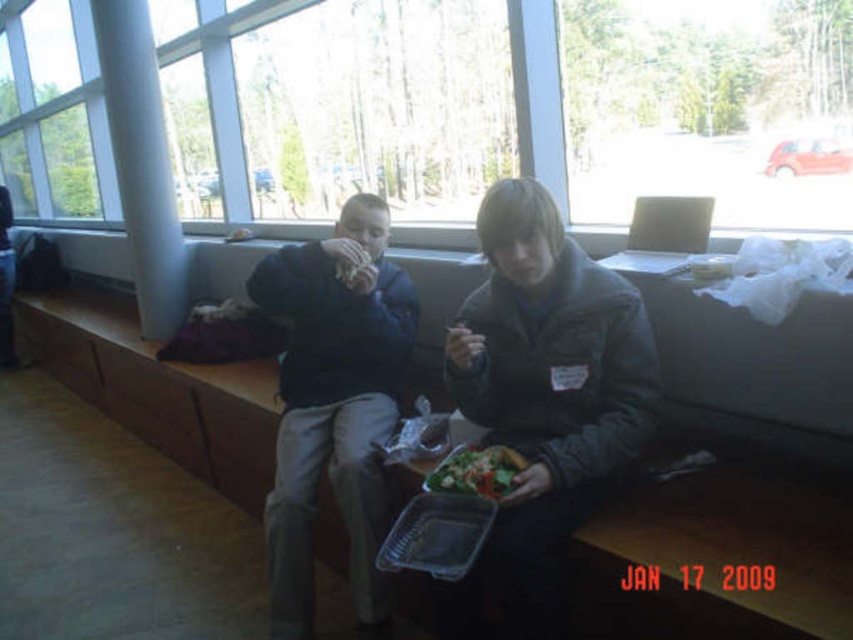
Between transparent glass window at upper center and matte brown sandwich at center, which one has less height?

Standing shorter between the two is matte brown sandwich at center.

Which is behind, point (222, 218) or point (363, 253)?

Positioned behind is point (222, 218).

Between point (790, 24) and point (360, 262), which one is positioned in front?

Point (790, 24) is more forward.

You are a GUI agent. You are given a task and a screenshot of the screen. Output one action in this format:
    pyautogui.click(x=<x>, y=<y>)
    Task: Click on the transparent glass window at upper center
    
    Given the screenshot: What is the action you would take?
    pyautogui.click(x=508, y=106)

Which is more to the left, dark gray jacket at center or white smooth pillar at center?

white smooth pillar at center

This screenshot has width=853, height=640. I want to click on dark gray jacket at center, so click(x=544, y=396).

You are a GUI agent. You are given a task and a screenshot of the screen. Output one action in this format:
    pyautogui.click(x=<x>, y=<y>)
    Task: Click on the dark gray jacket at center
    This screenshot has width=853, height=640.
    Given the screenshot: What is the action you would take?
    pyautogui.click(x=544, y=396)

Does dark gray jacket at center lie behind green leafy salad at center?

That is False.

Does point (296, 246) come behind point (469, 465)?

Yes, it is behind point (469, 465).

The height and width of the screenshot is (640, 853). I want to click on dark gray jacket at center, so point(544,396).

Image resolution: width=853 pixels, height=640 pixels. In order to click on dark gray jacket at center in this screenshot , I will do pyautogui.click(x=544, y=396).